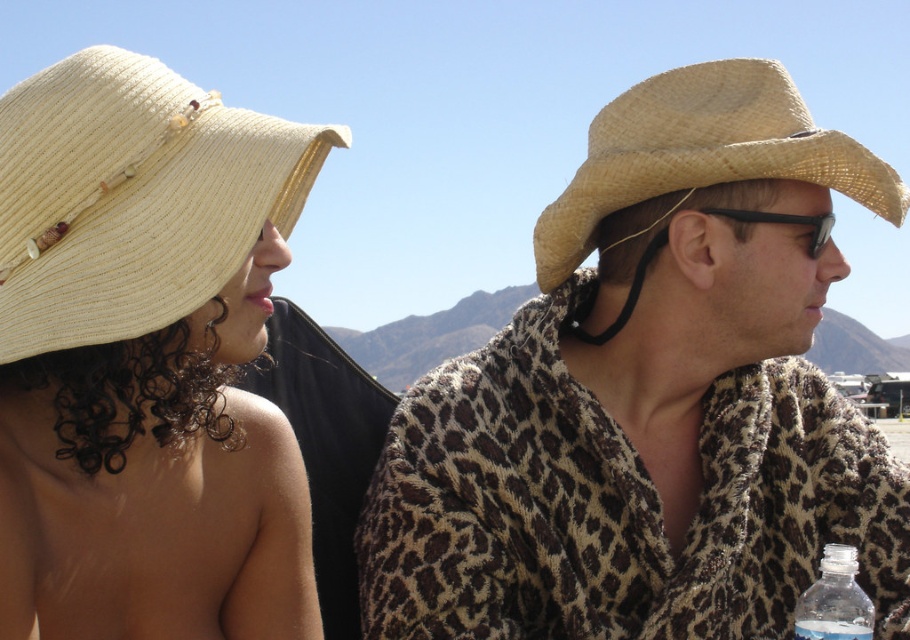
You are a photographer trying to capture a closeup shot of both the leopard print towel at center and the black plastic goggles at upper right. Your camera has a maximum focus range of 24 inches. Can you fit both items in the frame without moving the camera?

The leopard print towel at center and black plastic goggles at upper right are 24.13 inches apart. Since the distance between them exceeds the camera maximum focus range of 24 inches, you cannot fit both items in the frame without moving the camera.

You are standing at the origin point in the image. The point at coordinates (x=650, y=397) is marked. What object is located at that point?

The point at coordinates (x=650, y=397) indicates the leopard print towel at center.

You are a photographer setting up a shot of the two people in the scene. You need to place a 1.5 meter long lighting rod between the clear plastic bottle at lower right and the black plastic goggles at upper right. Will the rod fit between them without overlapping either object?

The clear plastic bottle at lower right is 1.44 meters from the black plastic goggles at upper right. Since the lighting rod is 1.5 meters long, it will not fit between them without overlapping either object because the distance is shorter than the rod.